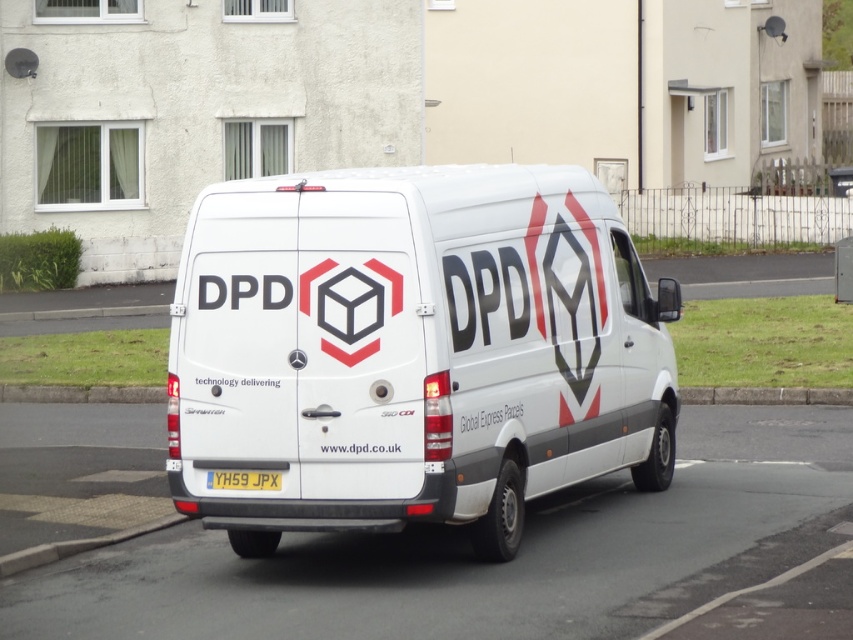
You are a delivery driver who just arrived at the residential street. You need to check if the white matte van at center is positioned in front of the yellow matte license plate at center. Is this true?

The white matte van at center is closer to the viewer than the yellow matte license plate at center, so yes, the white matte van at center is positioned in front of the yellow matte license plate at center.

In the scene shown: You are a delivery driver who needs to park your white matte van at center in a parking spot that requires the license plate to be visible at all times. Given the spatial relationship between the van and the license plate, can you confirm if the yellow matte license plate at center will remain visible when the van is parked?

The white matte van at center is taller than the yellow matte license plate at center, so the license plate will remain visible as it is positioned below the van and not obstructed by its height.